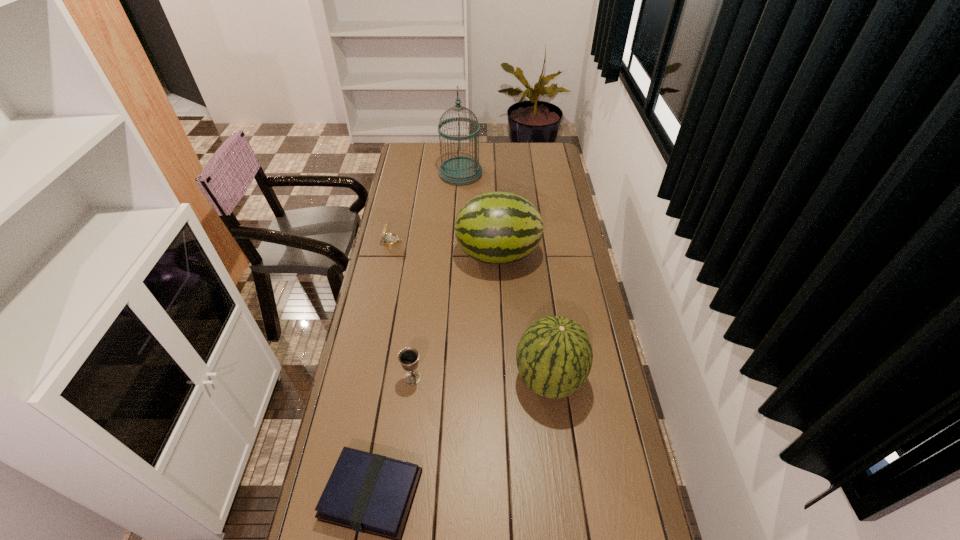
You are a GUI agent. You are given a task and a screenshot of the screen. Output one action in this format:
    pyautogui.click(x=<x>, y=<y>)
    Task: Click on the free space that satisfies the following two spatial constraints: 1. on the front-facing side of the birdcage; 2. on the front side of the third shortest object
    Image resolution: width=960 pixels, height=540 pixels.
    Given the screenshot: What is the action you would take?
    pyautogui.click(x=449, y=377)

In order to click on free point that satisfies the following two spatial constraints: 1. at the stem end of the nearer watermelon; 2. on the left side of the farther watermelon in this screenshot , I will do `click(503, 380)`.

The height and width of the screenshot is (540, 960). I want to click on vacant area in the image that satisfies the following two spatial constraints: 1. on the front-facing side of the tallest object; 2. on the left side of the nearer watermelon, so click(449, 380).

The width and height of the screenshot is (960, 540). Identify the location of free space that satisfies the following two spatial constraints: 1. at the stem end of the farther watermelon; 2. on the left side of the nearer watermelon. (503, 380).

Find the location of a particular element. free spot that satisfies the following two spatial constraints: 1. with the dial facing the compass; 2. on the back side of the chalice is located at coordinates (363, 377).

The image size is (960, 540). What are the coordinates of `free location that satisfies the following two spatial constraints: 1. on the back side of the nearer watermelon; 2. at the stem end of the farther watermelon` in the screenshot? It's located at (534, 254).

Identify the location of free spot that satisfies the following two spatial constraints: 1. with the dial facing the second shortest object; 2. on the right side of the nearer watermelon. (363, 380).

Locate an element on the screen. free space that satisfies the following two spatial constraints: 1. at the stem end of the farther watermelon; 2. on the front side of the third shortest object is located at coordinates (503, 377).